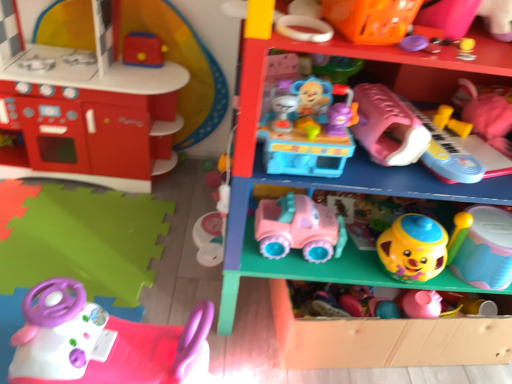
The width and height of the screenshot is (512, 384). Find the location of `vacant region in front of yellow rubber toy at upper right, the ninth toy positioned from the left`. vacant region in front of yellow rubber toy at upper right, the ninth toy positioned from the left is located at coordinates (473, 150).